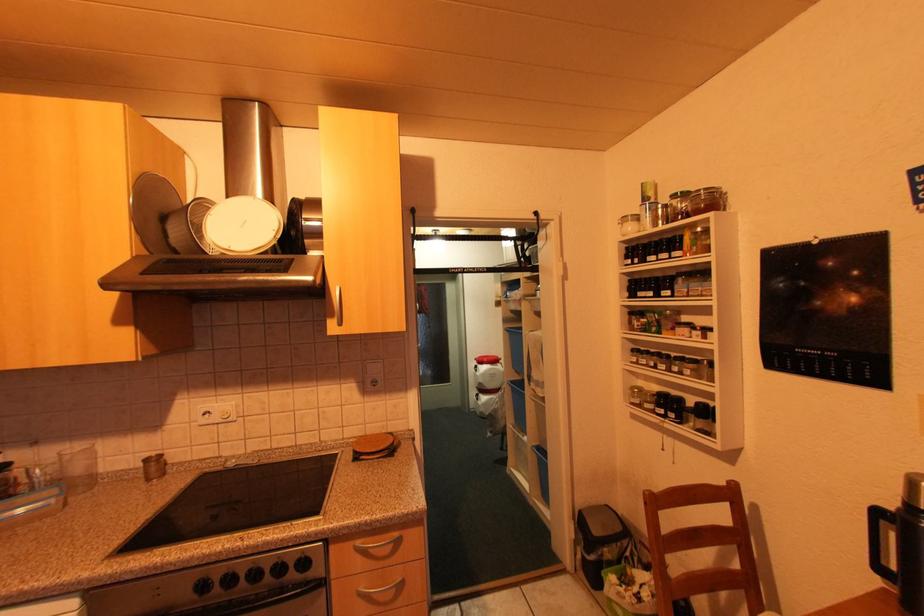
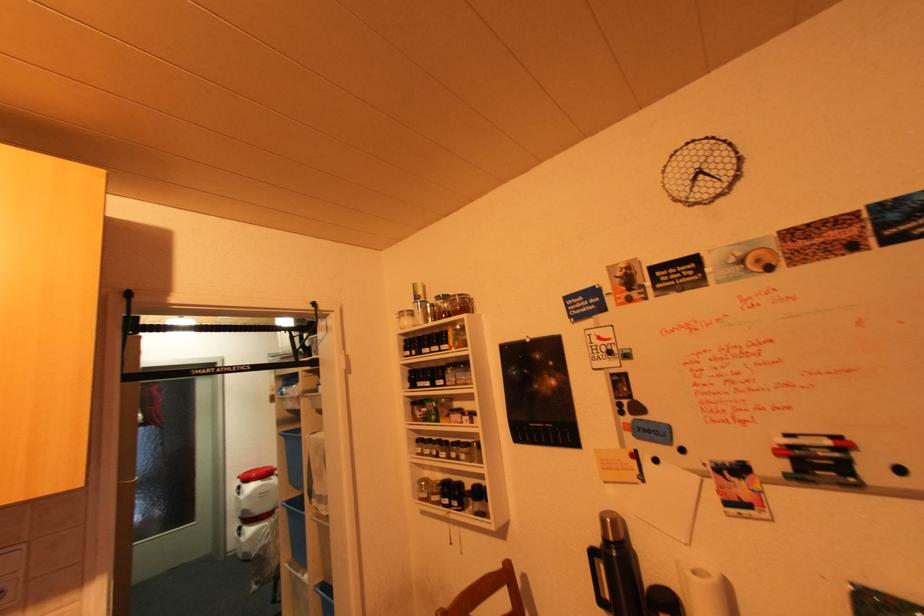
Question: The camera is either moving clockwise (left) or counter-clockwise (right) around the object. The first image is from the beginning of the video and the second image is from the end. Is the camera moving left or right when shooting the video?

Choices:
 (A) Left
 (B) Right

Answer: (A)